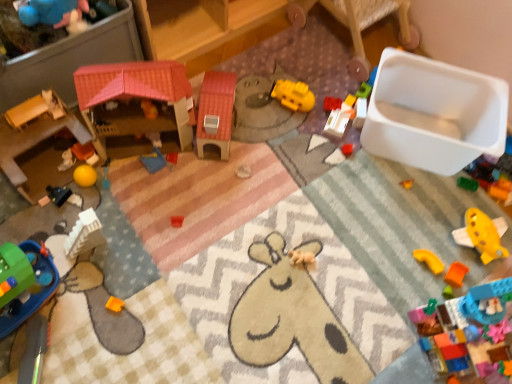
You are a GUI agent. You are given a task and a screenshot of the screen. Output one action in this format:
    pyautogui.click(x=<x>, y=<y>)
    Task: Click on the empty space that is in between matte orange blocks at left, the eleventh toy viewed from the right, and translucent blue plastic blocks at lower right, the third toy viewed from the right
    The image size is (512, 384).
    Given the screenshot: What is the action you would take?
    pyautogui.click(x=288, y=261)